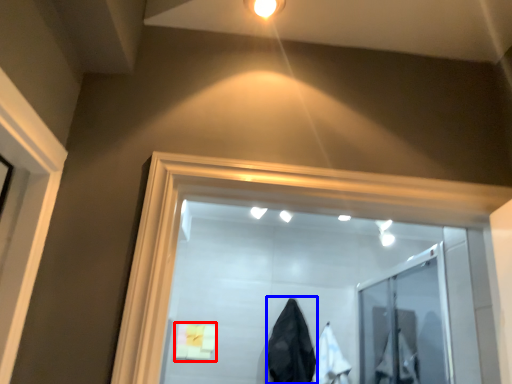
Question: Which object appears closest to the camera in this image, bath towel (highlighted by a red box) or garment (highlighted by a blue box)?

Choices:
 (A) bath towel
 (B) garment

Answer: (B)